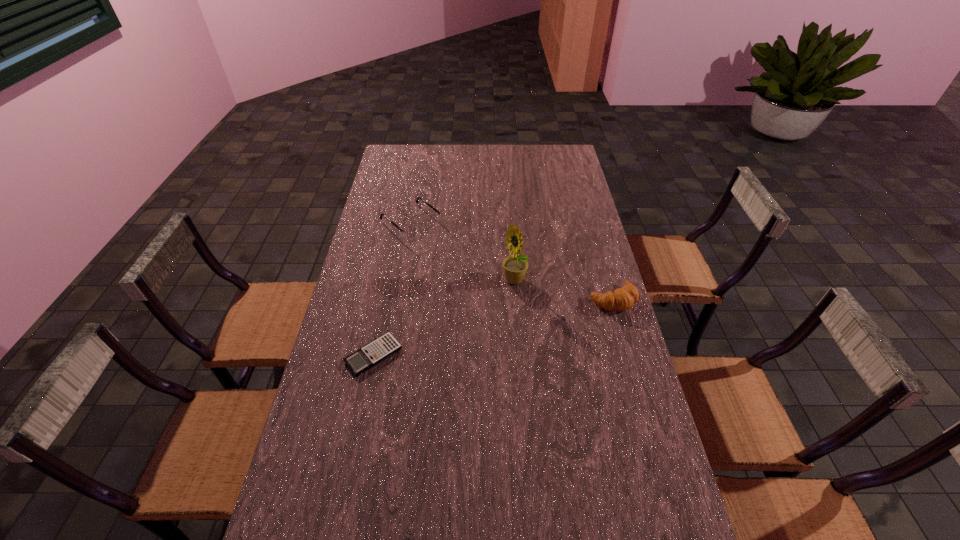
Find the location of a particular element. The image size is (960, 540). free space on the desktop that is between the nearest object and the rightmost object and is positioned on the face of the second object from right to left is located at coordinates (481, 330).

I want to click on free space on the desktop that is between the nearest object and the crescent roll and is positioned at the hinge ends of the spectacles, so click(525, 320).